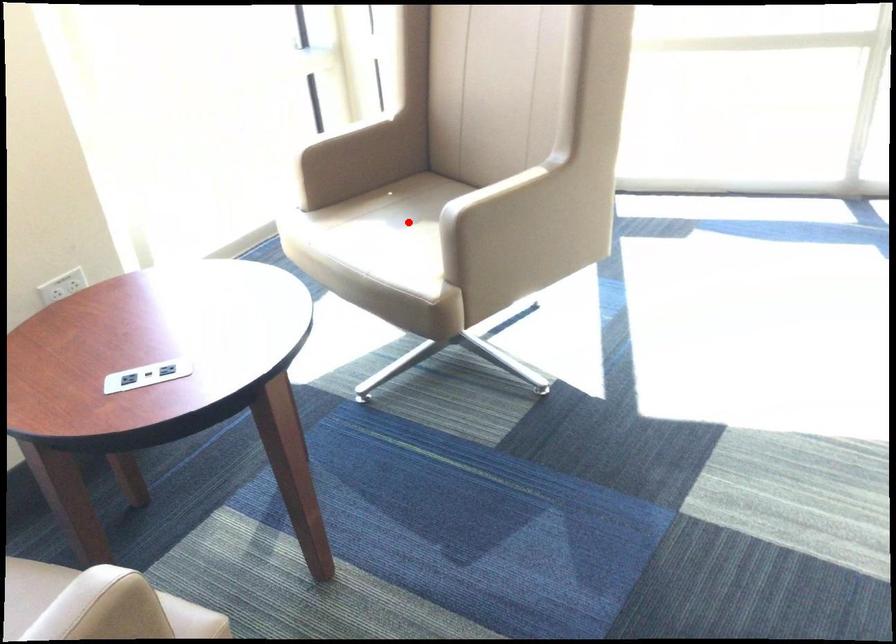
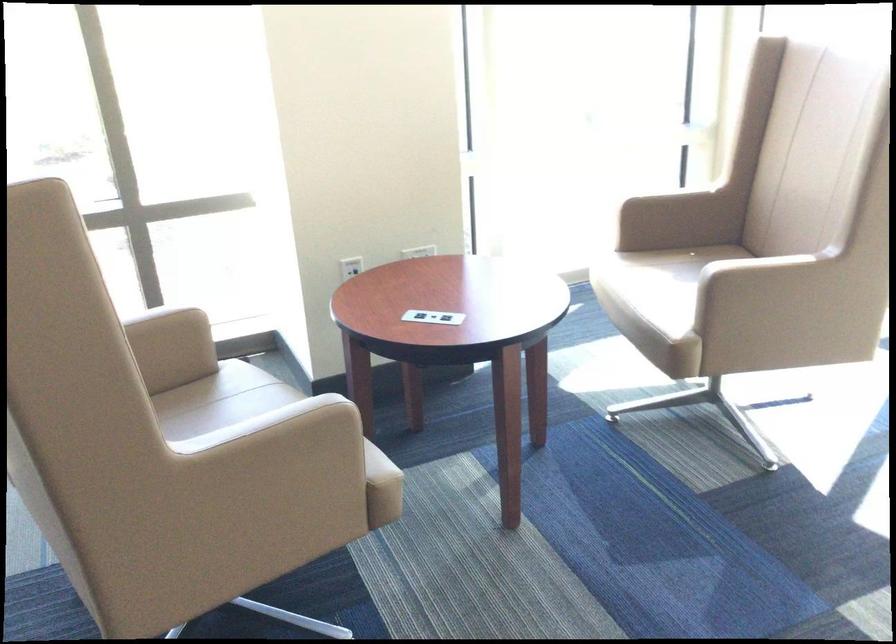
Question: I am providing you with two images of the same scene from different viewpoints. A red point is marked on the first image. Is the red point's position out of view in image 2?

Choices:
 (A) Yes
 (B) No

Answer: (A)